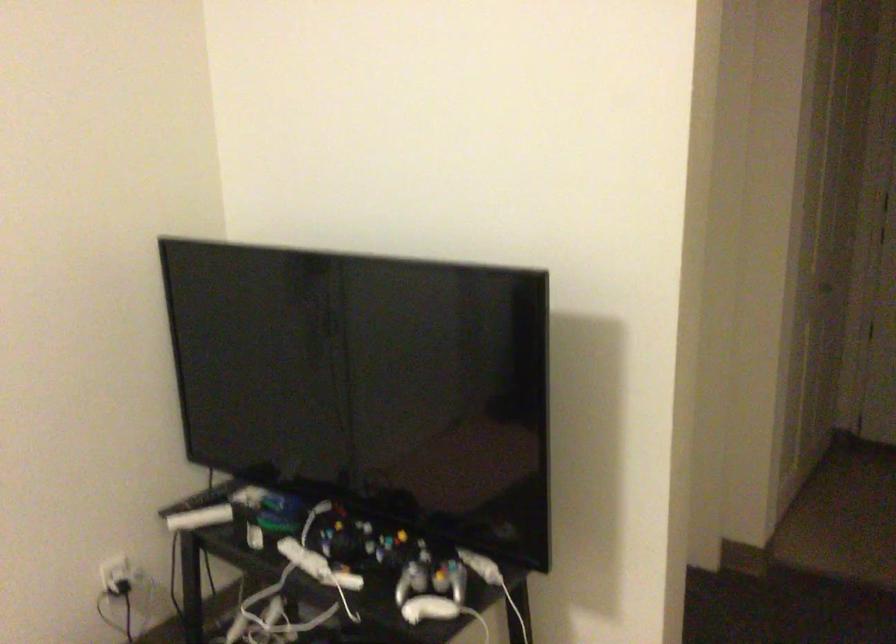
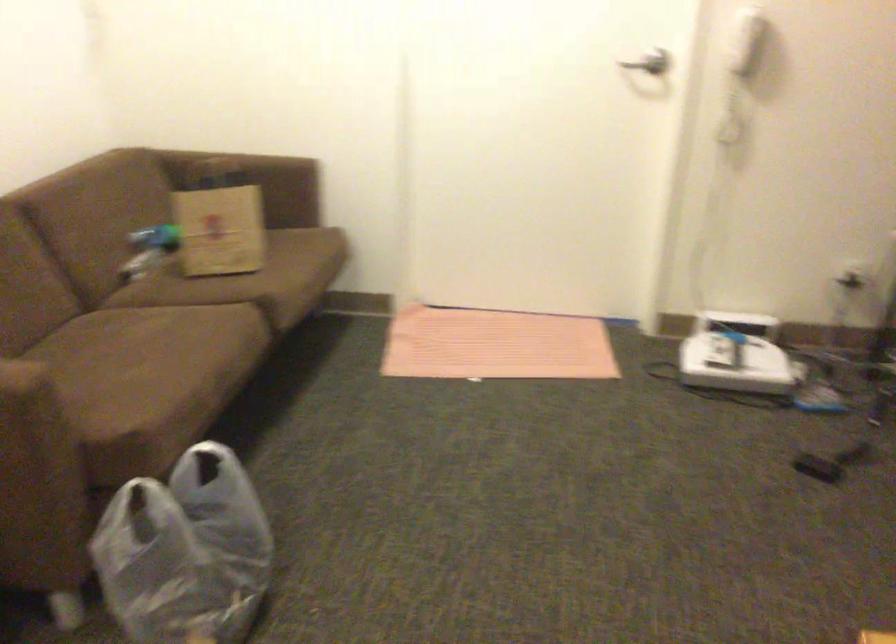
How did the camera likely rotate?

The rotation direction of the camera is left-down.